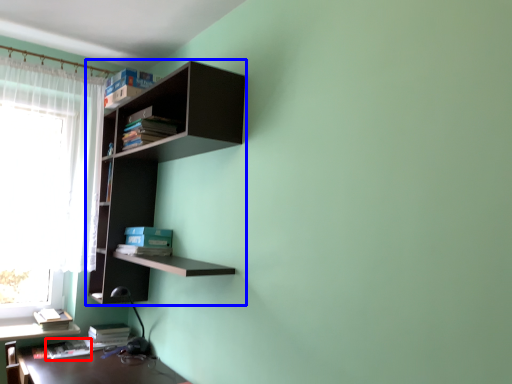
Question: Which of the following is the closest to the observer, book (highlighted by a red box) or shelf (highlighted by a blue box)?

Choices:
 (A) book
 (B) shelf

Answer: (B)